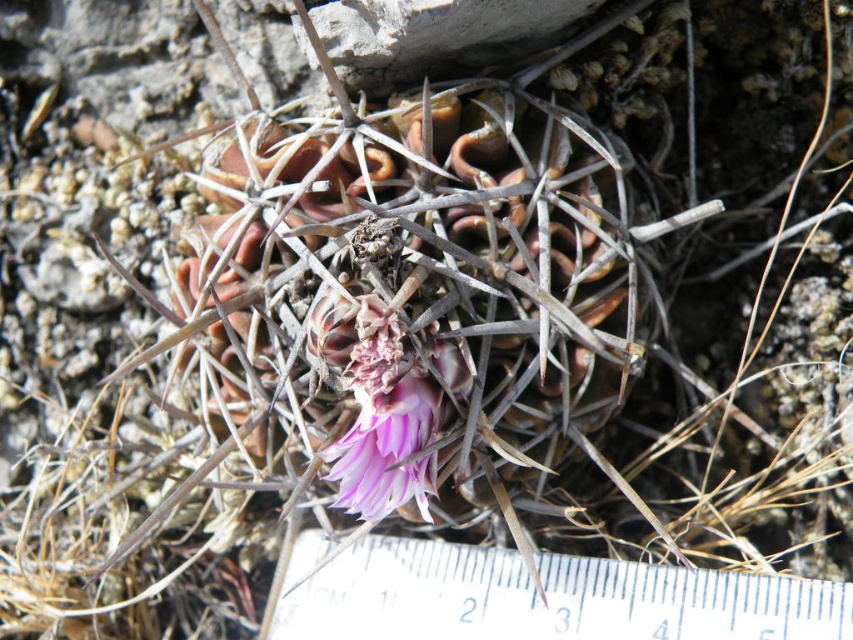
Question: Does white plastic ruler at center have a larger size compared to pink matte flower at center?

Choices:
 (A) no
 (B) yes

Answer: (B)

Question: Does white plastic ruler at center have a larger size compared to pink matte flower at center?

Choices:
 (A) no
 (B) yes

Answer: (B)

Question: Which object is closer to the camera taking this photo?

Choices:
 (A) pink matte flower at center
 (B) white plastic ruler at center

Answer: (A)

Question: Does white plastic ruler at center come behind pink matte flower at center?

Choices:
 (A) no
 (B) yes

Answer: (B)

Question: Among these objects, which one is nearest to the camera?

Choices:
 (A) white plastic ruler at center
 (B) pink matte flower at center

Answer: (B)